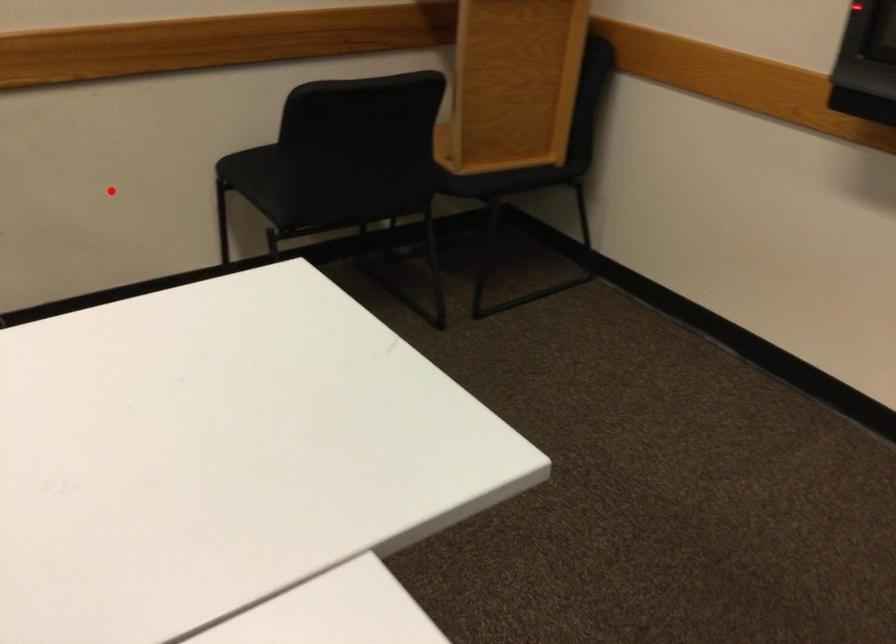
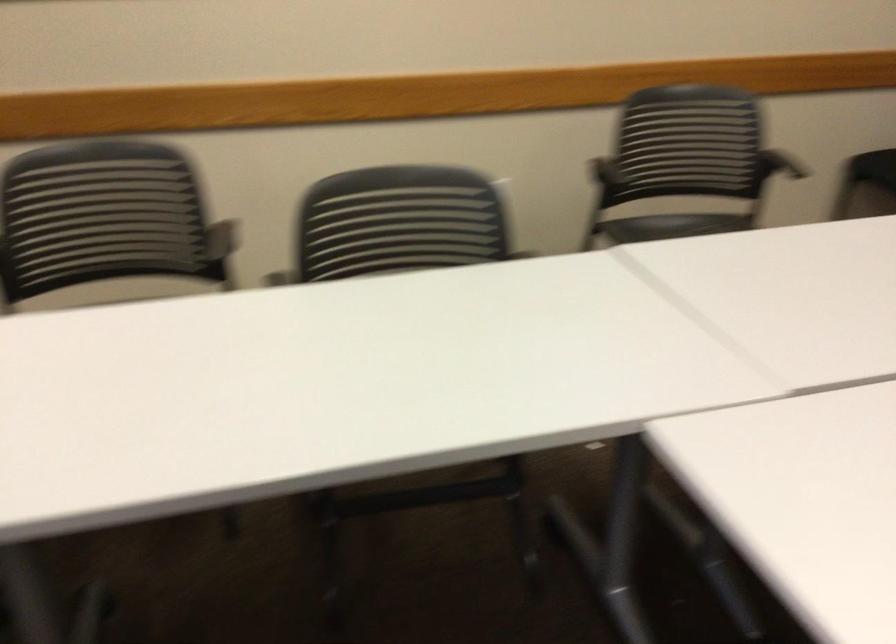
Find the pixel in the second image that matches the highlighted location in the first image.

(790, 166)